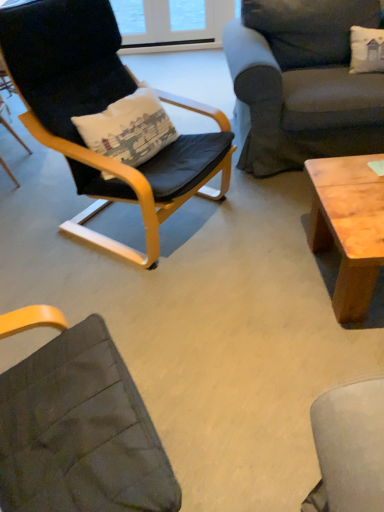
Where is `vacant area that is in front of black leather chair at left, which is the second chair from left to right`? vacant area that is in front of black leather chair at left, which is the second chair from left to right is located at coordinates (165, 304).